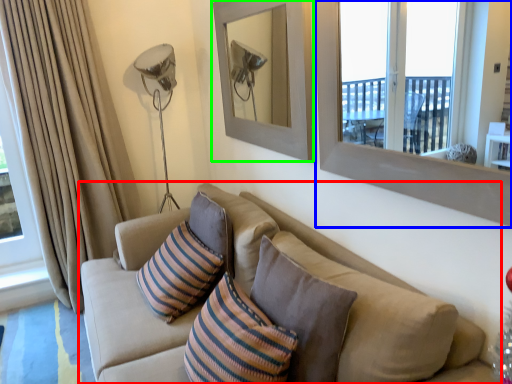
Question: Which object is the closest to the studio couch (highlighted by a red box)? Choose among these: window frame (highlighted by a blue box) or picture frame (highlighted by a green box).

Choices:
 (A) window frame
 (B) picture frame

Answer: (A)